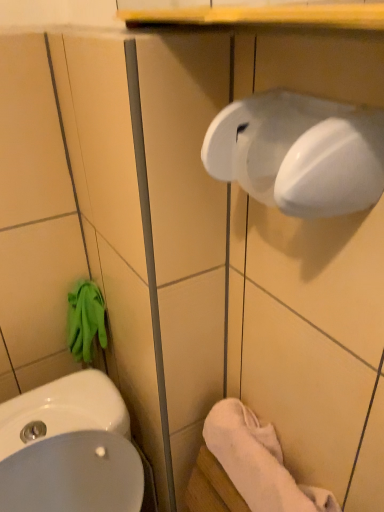
Question: Is white soft towel at lower right not within white glossy sink at lower left?

Choices:
 (A) no
 (B) yes

Answer: (B)

Question: From the image's perspective, is white soft towel at lower right beneath white glossy sink at lower left?

Choices:
 (A) yes
 (B) no

Answer: (B)

Question: Does white soft towel at lower right have a lesser height compared to white glossy sink at lower left?

Choices:
 (A) yes
 (B) no

Answer: (A)

Question: Is white soft towel at lower right further to camera compared to white glossy sink at lower left?

Choices:
 (A) yes
 (B) no

Answer: (A)

Question: Does white soft towel at lower right turn towards white glossy sink at lower left?

Choices:
 (A) yes
 (B) no

Answer: (B)

Question: Is white soft towel at lower right surrounding white glossy sink at lower left?

Choices:
 (A) no
 (B) yes

Answer: (A)

Question: Is white glossy sink at lower left surrounded by white glossy hand dryer at upper right?

Choices:
 (A) yes
 (B) no

Answer: (B)

Question: From the image's perspective, is white glossy hand dryer at upper right above white glossy sink at lower left?

Choices:
 (A) no
 (B) yes

Answer: (B)

Question: From a real-world perspective, does white glossy hand dryer at upper right sit lower than white glossy sink at lower left?

Choices:
 (A) yes
 (B) no

Answer: (B)

Question: Can you confirm if white glossy hand dryer at upper right is bigger than white glossy sink at lower left?

Choices:
 (A) yes
 (B) no

Answer: (B)

Question: Can you confirm if white glossy hand dryer at upper right is shorter than white glossy sink at lower left?

Choices:
 (A) no
 (B) yes

Answer: (B)

Question: Can you confirm if white glossy hand dryer at upper right is smaller than white glossy sink at lower left?

Choices:
 (A) no
 (B) yes

Answer: (B)

Question: From the image's perspective, is white glossy sink at lower left located above white soft towel at lower right?

Choices:
 (A) yes
 (B) no

Answer: (B)